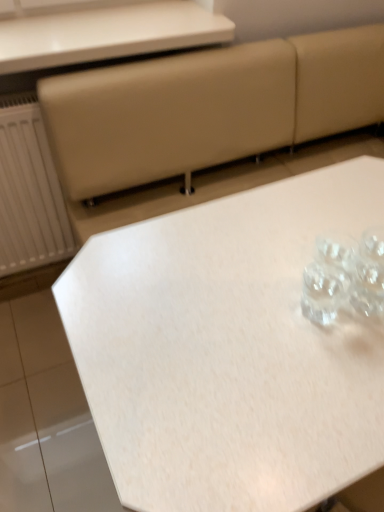
Question: Which is correct: white matte table at center, the 1th table when ordered from bottom to top, is inside white glossy table at upper center, marked as the first table in a top-to-bottom arrangement, or outside of it?

Choices:
 (A) outside
 (B) inside

Answer: (A)

Question: Considering the positions of white matte table at center, the 1th table when ordered from bottom to top, and white glossy table at upper center, placed as the second table when sorted from bottom to top, in the image, is white matte table at center, the 1th table when ordered from bottom to top, taller or shorter than white glossy table at upper center, placed as the second table when sorted from bottom to top,?

Choices:
 (A) short
 (B) tall

Answer: (B)

Question: Is white matte table at center, acting as the 2th table starting from the top, bigger or smaller than white glossy table at upper center, placed as the second table when sorted from bottom to top?

Choices:
 (A) small
 (B) big

Answer: (B)

Question: Is point (31, 66) closer or farther from the camera than point (276, 270)?

Choices:
 (A) closer
 (B) farther

Answer: (B)

Question: From a real-world perspective, relative to white matte table at center, the 1th table when ordered from bottom to top, is white glossy table at upper center, marked as the first table in a top-to-bottom arrangement, vertically above or below?

Choices:
 (A) below
 (B) above

Answer: (B)

Question: Do you think white glossy table at upper center, placed as the second table when sorted from bottom to top, is within white matte table at center, acting as the 2th table starting from the top, or outside of it?

Choices:
 (A) inside
 (B) outside

Answer: (B)

Question: In terms of width, does white glossy table at upper center, marked as the first table in a top-to-bottom arrangement, look wider or thinner when compared to white matte table at center, acting as the 2th table starting from the top?

Choices:
 (A) thin
 (B) wide

Answer: (A)